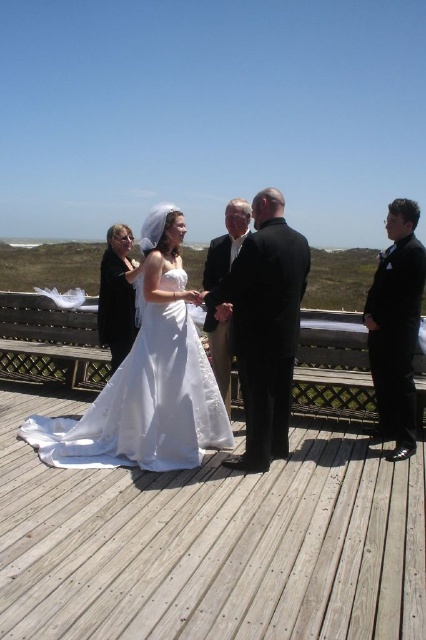
Who is more forward, [198,403] or [109,346]?

Point [198,403] is more forward.

Can you confirm if white satin dress at center is taller than matte black dress at left?

Yes, white satin dress at center is taller than matte black dress at left.

This screenshot has width=426, height=640. What do you see at coordinates (144, 404) in the screenshot?
I see `white satin dress at center` at bounding box center [144, 404].

The width and height of the screenshot is (426, 640). In order to click on white satin dress at center in this screenshot , I will do `click(144, 404)`.

Looking at this image, who is more forward, (167, 570) or (112, 250)?

Positioned in front is point (167, 570).

Is point (267, 529) more distant than point (111, 276)?

No, (267, 529) is closer to viewer.

Find the location of a particular element. Image resolution: width=426 pixels, height=640 pixels. wooden at center is located at coordinates (212, 541).

Between point (169, 284) and point (414, 216), which one is positioned behind?

The point (169, 284) is behind.

Measure the distance between white satin dress at center and camera.

white satin dress at center and camera are 3.98 meters apart.

This screenshot has width=426, height=640. Find the location of `white satin dress at center`. white satin dress at center is located at coordinates (144, 404).